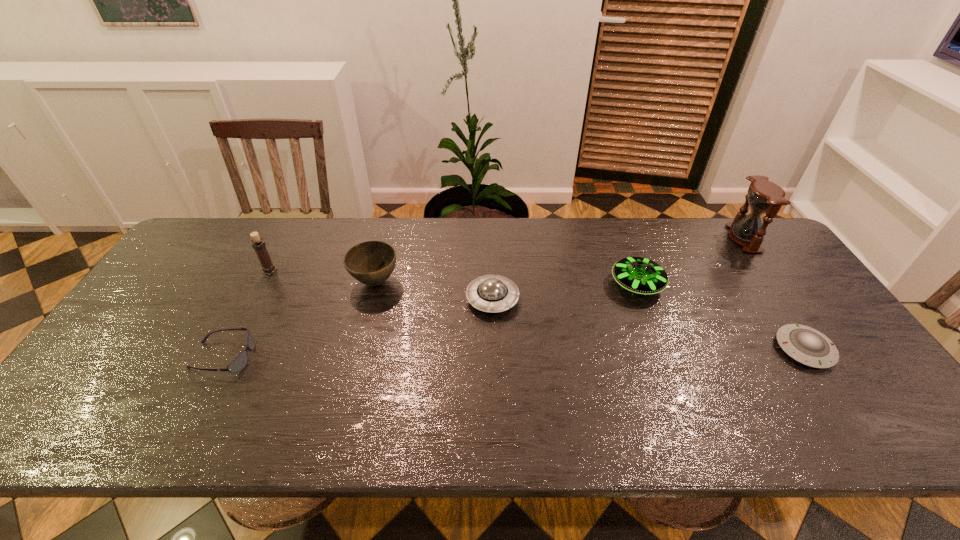
Find the location of a particular element. Image resolution: width=960 pixels, height=540 pixels. object that is the second closest to the shortest object is located at coordinates (764, 196).

Locate an element on the screen. The width and height of the screenshot is (960, 540). saucer object that ranks as the second closest to the nearest saucer is located at coordinates (490, 293).

Locate which saucer is the third closest to the sixth shortest object. Please provide its 2D coordinates. Your answer should be formatted as a tuple, i.e. [(x, y)], where the tuple contains the x and y coordinates of a point satisfying the conditions above.

[(804, 344)]

Where is `free location that satisfies the following two spatial constraints: 1. on the front side of the fifth shortest object; 2. on the left side of the fourth tallest object`? free location that satisfies the following two spatial constraints: 1. on the front side of the fifth shortest object; 2. on the left side of the fourth tallest object is located at coordinates (374, 285).

Identify the location of vacant space that satisfies the following two spatial constraints: 1. on the back side of the tallest object; 2. on the right side of the shortest saucer. (731, 239).

The image size is (960, 540). What are the coordinates of `blank space that satisfies the following two spatial constraints: 1. on the back side of the fifth object from right to left; 2. on the left side of the tallest object` in the screenshot? It's located at (386, 239).

The height and width of the screenshot is (540, 960). I want to click on free space that satisfies the following two spatial constraints: 1. on the front side of the second saucer from left to right; 2. on the left side of the second tallest object, so click(x=263, y=285).